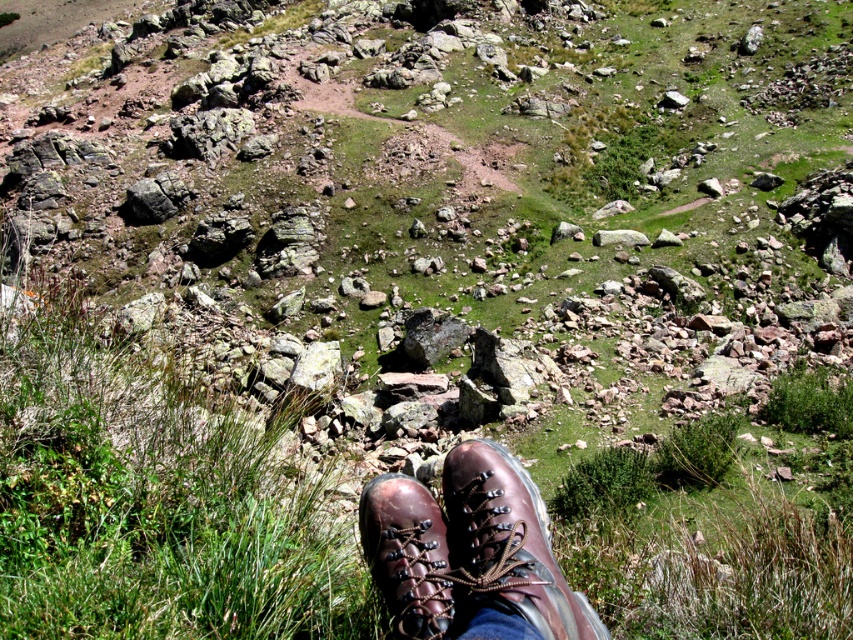
Question: Among these points, which one is farthest from the camera?

Choices:
 (A) (502, 602)
 (B) (426, 563)

Answer: (B)

Question: Which point is farther to the camera?

Choices:
 (A) (410, 522)
 (B) (451, 477)

Answer: (B)

Question: Does shiny brown leather boot at lower center appear on the right side of brown leather boot at lower center?

Choices:
 (A) yes
 (B) no

Answer: (A)

Question: Does shiny brown leather boot at lower center appear over brown leather boot at lower center?

Choices:
 (A) no
 (B) yes

Answer: (A)

Question: Does shiny brown leather boot at lower center appear over brown leather boot at lower center?

Choices:
 (A) no
 (B) yes

Answer: (A)